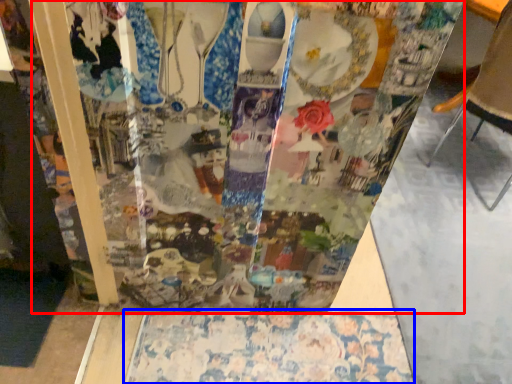
Question: Which point is closer to the camera, glass box (highlighted by a red box) or tablecloth (highlighted by a blue box)?

Choices:
 (A) glass box
 (B) tablecloth

Answer: (A)